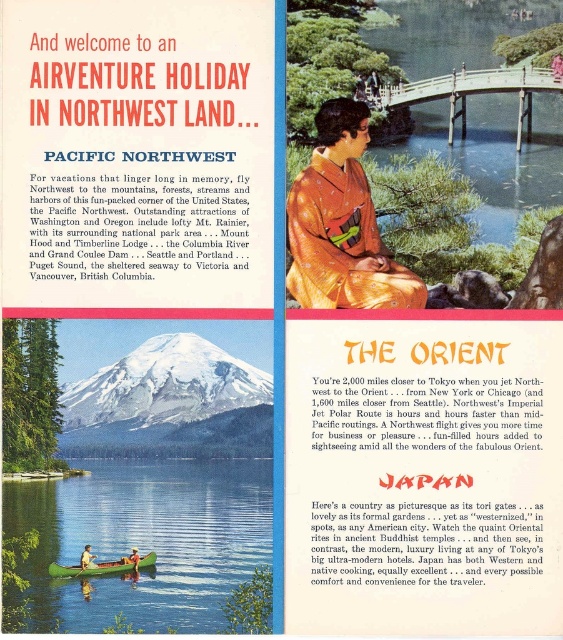
Question: Which object appears closest to the camera in this image?

Choices:
 (A) green matte canoe at lower left
 (B) green smooth water at lower left
 (C) matte orange kimono at upper center

Answer: (B)

Question: Estimate the real-world distances between objects in this image. Which object is farther from the orange silk kimono at center?

Choices:
 (A) matte orange kimono at upper center
 (B) green smooth water at lower left

Answer: (A)

Question: Is green smooth water at lower left further to the viewer compared to orange silk kimono at center?

Choices:
 (A) no
 (B) yes

Answer: (A)

Question: Does orange silk kimono at center come in front of matte orange kimono at upper center?

Choices:
 (A) no
 (B) yes

Answer: (B)

Question: Which of the following is the farthest from the observer?

Choices:
 (A) green matte canoe at lower left
 (B) orange silk kimono at center
 (C) green smooth water at lower left
 (D) matte orange kimono at upper center

Answer: (D)

Question: Is orange silk kimono at center positioned in front of green matte canoe at lower left?

Choices:
 (A) yes
 (B) no

Answer: (B)